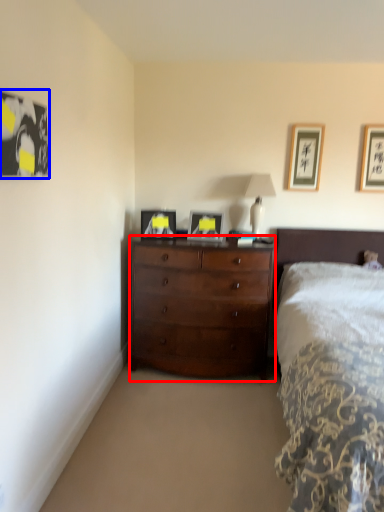
Question: Which object appears farthest to the camera in this image, chest of drawers (highlighted by a red box) or picture frame (highlighted by a blue box)?

Choices:
 (A) chest of drawers
 (B) picture frame

Answer: (A)